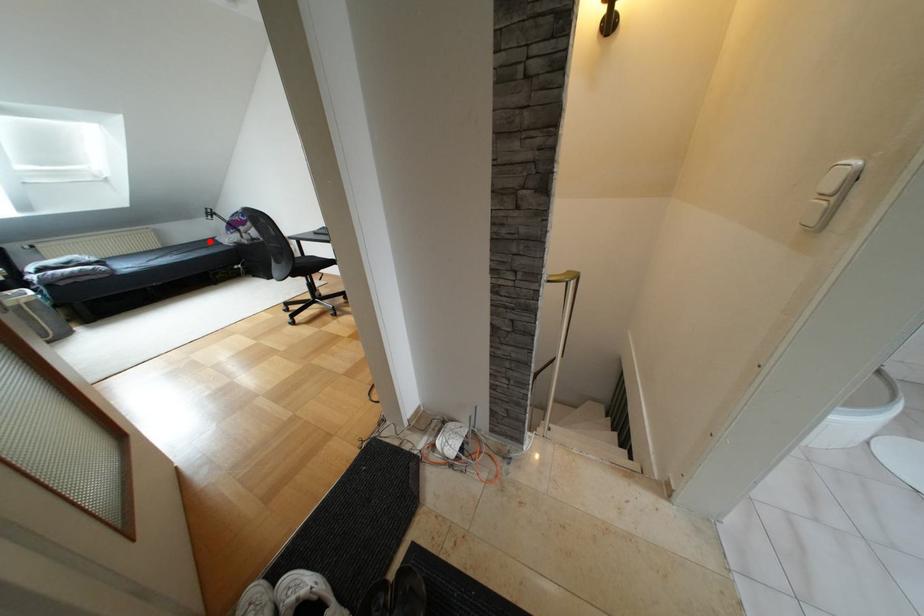
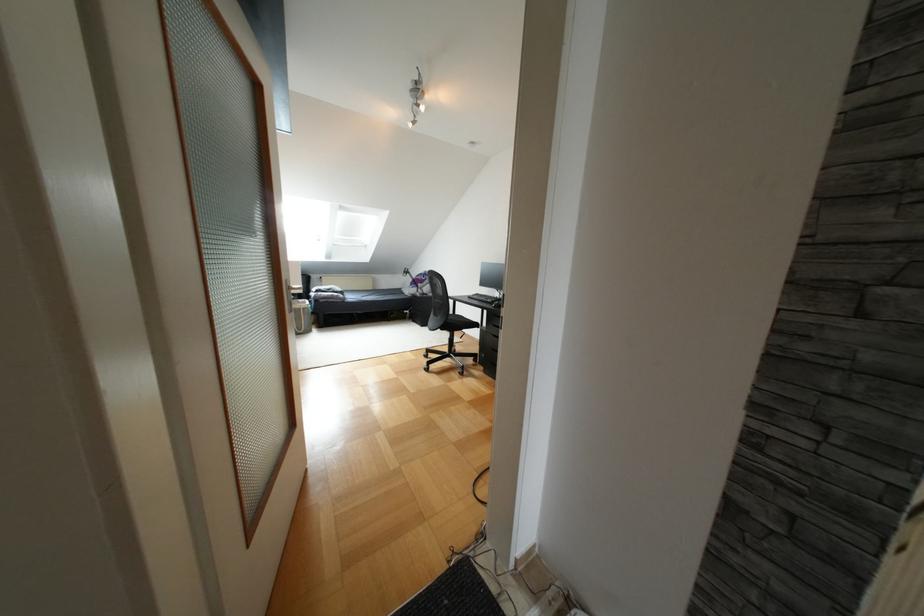
Where in the second image is the point corresponding to the highlighted location from the first image?

(396, 290)